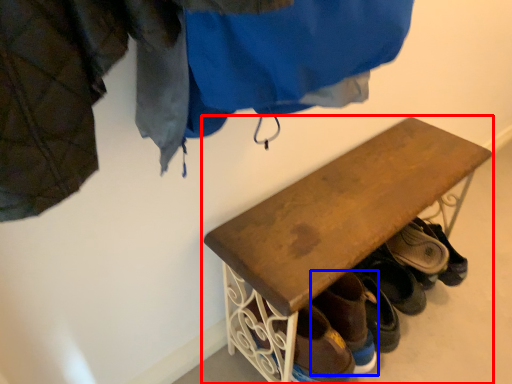
Question: Which point is further to the camera, furniture (highlighted by a red box) or footwear (highlighted by a blue box)?

Choices:
 (A) furniture
 (B) footwear

Answer: (B)